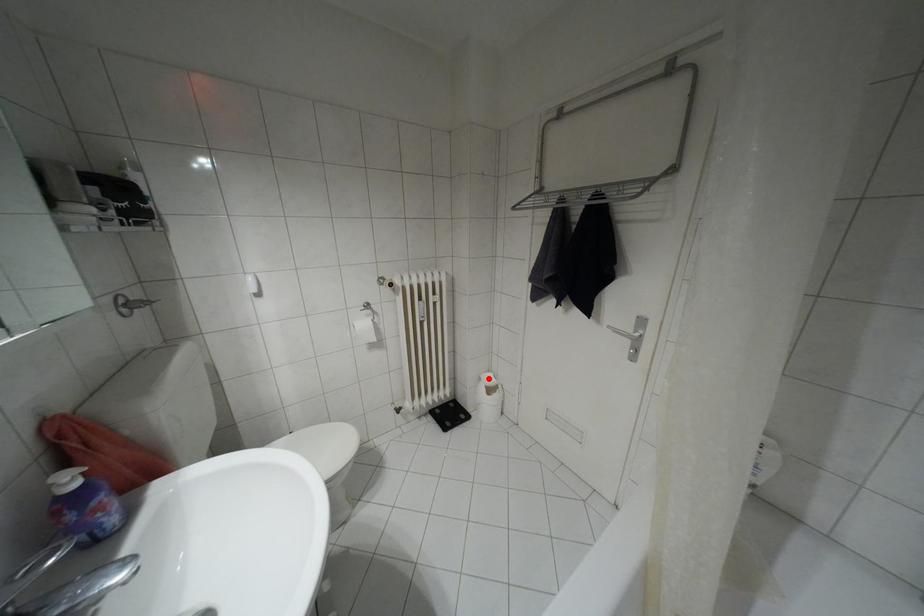
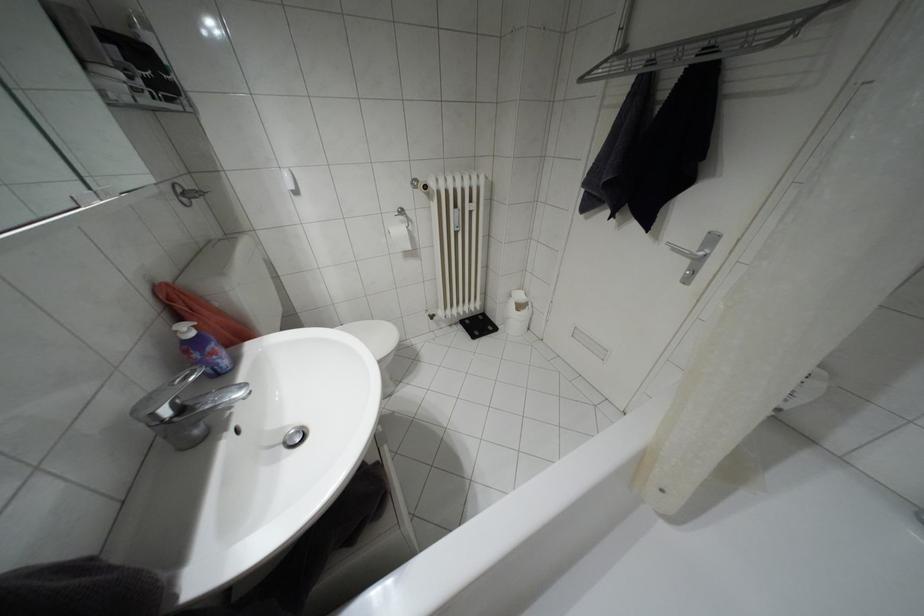
Question: I am providing you with two images of the same scene from different viewpoints. In image1, a red point is highlighted. Considering the same 3D point in image2, which of the following is correct?

Choices:
 (A) It is closer
 (B) It is farther

Answer: (A)